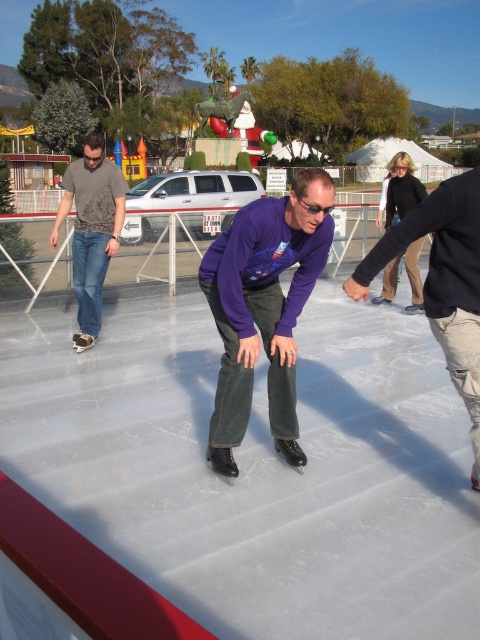
Question: Which of the following is the closest to the observer?

Choices:
 (A) dark gray jeans at center
 (B) matte gray shirt at left
 (C) matte black ice at center
 (D) purple matte shirt at center

Answer: (C)

Question: Estimate the real-world distances between objects in this image. Which object is farther from the dark gray jeans at center?

Choices:
 (A) matte black ice at center
 (B) matte gray shirt at left
 (C) purple matte shirt at center

Answer: (B)

Question: Which point is closer to the camera?

Choices:
 (A) (99, 276)
 (B) (28, 480)

Answer: (B)

Question: Does dark gray jeans at center appear over matte gray shirt at left?

Choices:
 (A) no
 (B) yes

Answer: (A)

Question: Can you confirm if purple matte shirt at center is wider than matte gray shirt at left?

Choices:
 (A) no
 (B) yes

Answer: (A)

Question: Does dark gray jeans at center appear on the right side of matte gray shirt at left?

Choices:
 (A) yes
 (B) no

Answer: (A)